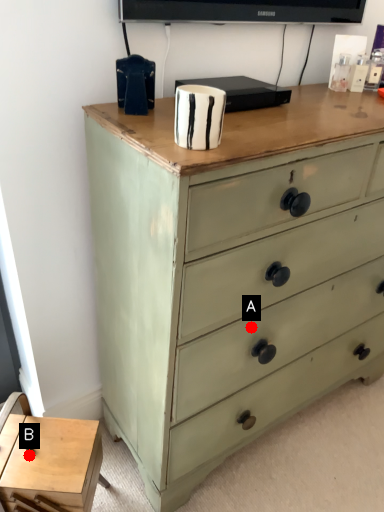
Question: Two points are circled on the image, labeled by A and B beside each circle. Which point appears farthest from the camera in this image?

Choices:
 (A) A is further
 (B) B is further

Answer: (B)